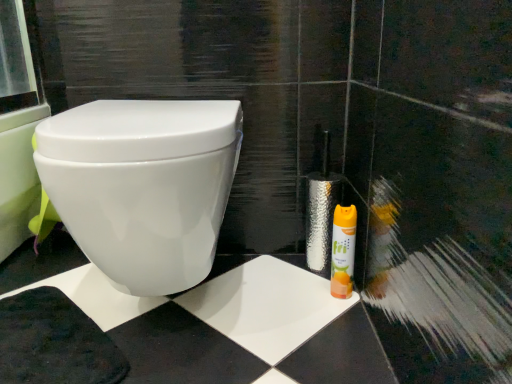
Locate an element on the screen. free space between white glossy toilet at center and yellow matte canister at lower right is located at coordinates (281, 304).